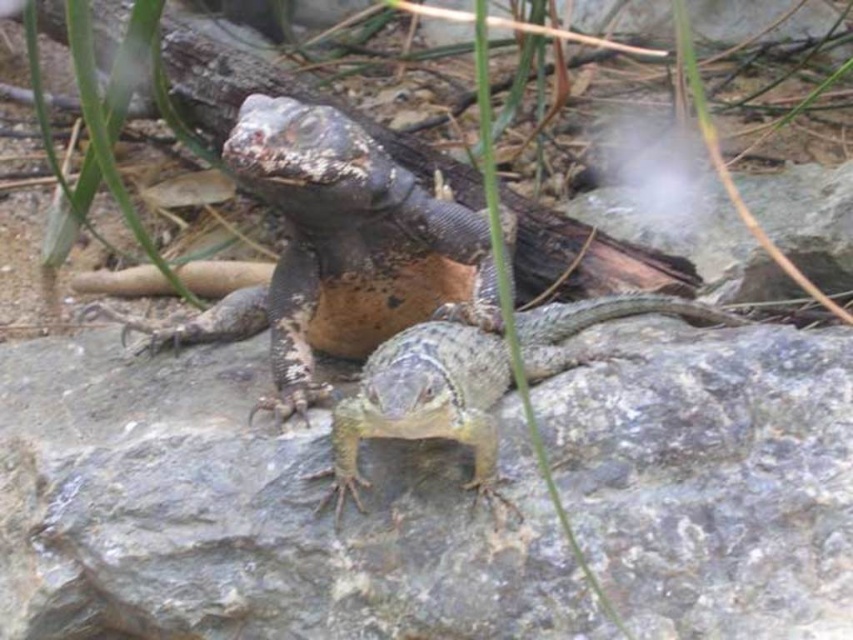
Is leathery brown lizard at center thinner than smooth gray lizard at center?

No.

You are a GUI agent. You are given a task and a screenshot of the screen. Output one action in this format:
    pyautogui.click(x=<x>, y=<y>)
    Task: Click on the leathery brown lizard at center
    This screenshot has height=640, width=853.
    Given the screenshot: What is the action you would take?
    pyautogui.click(x=337, y=250)

Can you confirm if gray rock at center is positioned below leathery brown lizard at center?

Yes, gray rock at center is below leathery brown lizard at center.

Is gray rock at center shorter than leathery brown lizard at center?

Indeed, gray rock at center has a lesser height compared to leathery brown lizard at center.

Does point (213, 358) lie behind point (428, 262)?

Yes, point (213, 358) is farther from viewer.

Identify the location of gray rock at center. This screenshot has width=853, height=640. (248, 515).

This screenshot has width=853, height=640. Describe the element at coordinates (248, 515) in the screenshot. I see `gray rock at center` at that location.

Who is more forward, (99, 513) or (419, 381)?

Positioned in front is point (419, 381).

Find the location of `gray rock at center`. gray rock at center is located at coordinates (248, 515).